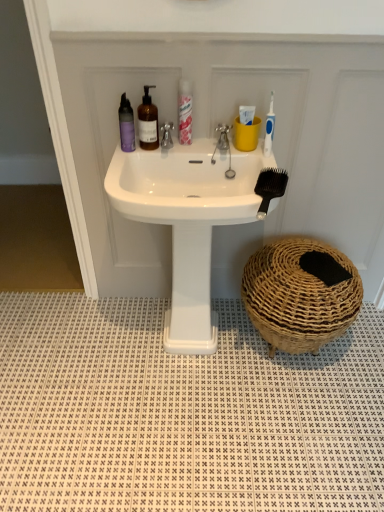
Locate an element on the screen. vacant region below white glossy sink at center (from a real-world perspective) is located at coordinates (186, 353).